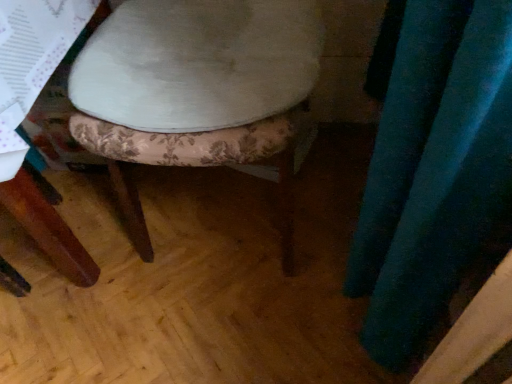
I want to click on vacant region under velvet floral-patterned stool at center (from a real-world perspective), so click(223, 206).